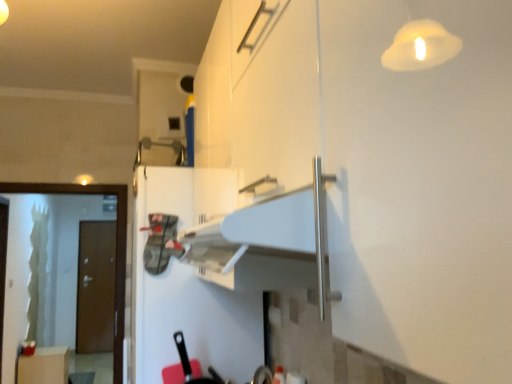
Question: Is point (90, 185) positioned closer to the camera than point (215, 188)?

Choices:
 (A) farther
 (B) closer

Answer: (A)

Question: From the image's perspective, relative to white matte refrigerator at center, is green frosted glass screen door at left above or below?

Choices:
 (A) below
 (B) above

Answer: (A)

Question: Which object is the closest to the green frosted glass screen door at left?

Choices:
 (A) brown matte door at left
 (B) white matte refrigerator at center
 (C) matte white cabinet at lower left

Answer: (B)

Question: Which of these objects is positioned closest to the brown matte door at left?

Choices:
 (A) green frosted glass screen door at left
 (B) white matte refrigerator at center
 (C) matte white cabinet at lower left

Answer: (C)